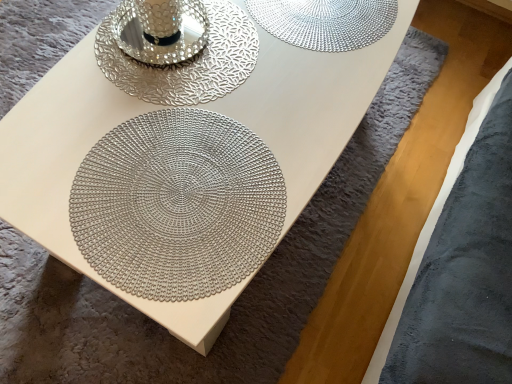
What do you see at coordinates (186, 62) in the screenshot? I see `silver textured candle holder at upper center` at bounding box center [186, 62].

I want to click on silver textured candle holder at upper center, so click(x=186, y=62).

What do you see at coordinates (177, 205) in the screenshot? This screenshot has width=512, height=384. I see `metallic silver mandala at center` at bounding box center [177, 205].

Where is `metallic silver mandala at center`? metallic silver mandala at center is located at coordinates (177, 205).

Locate an element on the screen. This screenshot has width=512, height=384. silver textured candle holder at upper center is located at coordinates (186, 62).

Can you confirm if silver textured candle holder at upper center is positioned to the left of metallic silver mandala at center?

Correct, you'll find silver textured candle holder at upper center to the left of metallic silver mandala at center.

Between silver textured candle holder at upper center and metallic silver mandala at center, which one is positioned behind?

silver textured candle holder at upper center is further from the camera.

Between point (249, 43) and point (137, 251), which one is positioned behind?

The point (249, 43) is farther.

From the image's perspective, is silver textured candle holder at upper center located beneath metallic silver mandala at center?

Actually, silver textured candle holder at upper center appears above metallic silver mandala at center in the image.

From a real-world perspective, is silver textured candle holder at upper center above or below metallic silver mandala at center?

silver textured candle holder at upper center is above metallic silver mandala at center.

Does silver textured candle holder at upper center have a greater width compared to metallic silver mandala at center?

No, silver textured candle holder at upper center is not wider than metallic silver mandala at center.

Considering the sizes of silver textured candle holder at upper center and metallic silver mandala at center in the image, is silver textured candle holder at upper center taller or shorter than metallic silver mandala at center?

Considering their sizes, silver textured candle holder at upper center has more height than metallic silver mandala at center.

In terms of size, does silver textured candle holder at upper center appear bigger or smaller than metallic silver mandala at center?

Considering their sizes, silver textured candle holder at upper center takes up more space than metallic silver mandala at center.

Do you think silver textured candle holder at upper center is within metallic silver mandala at center, or outside of it?

The correct answer is: outside.

Is silver textured candle holder at upper center not near metallic silver mandala at center?

That's not correct — silver textured candle holder at upper center is a little close to metallic silver mandala at center.

Is silver textured candle holder at upper center oriented away from metallic silver mandala at center?

silver textured candle holder at upper center does not have its back to metallic silver mandala at center.

Locate an element on the screen. The height and width of the screenshot is (384, 512). mandala beneath the silver textured candle holder at upper center (from a real-world perspective) is located at coordinates (177, 205).

Between metallic silver mandala at center and silver textured candle holder at upper center, which one appears on the right side from the viewer's perspective?

Positioned to the right is metallic silver mandala at center.

Is the depth of metallic silver mandala at center greater than that of silver textured candle holder at upper center?

No, it is not.

Considering the points (89, 232) and (136, 66), which point is in front, point (89, 232) or point (136, 66)?

Positioned in front is point (89, 232).

From the image's perspective, which is above, metallic silver mandala at center or silver textured candle holder at upper center?

silver textured candle holder at upper center is shown above in the image.

From a real-world perspective, does metallic silver mandala at center stand above silver textured candle holder at upper center?

No, from a real-world perspective, metallic silver mandala at center is not over silver textured candle holder at upper center

Which object is wider, metallic silver mandala at center or silver textured candle holder at upper center?

Wider between the two is metallic silver mandala at center.

Can you confirm if metallic silver mandala at center is taller than silver textured candle holder at upper center?

No, metallic silver mandala at center is not taller than silver textured candle holder at upper center.

Considering the sizes of objects metallic silver mandala at center and silver textured candle holder at upper center in the image provided, who is bigger, metallic silver mandala at center or silver textured candle holder at upper center?

silver textured candle holder at upper center is bigger.

Is metallic silver mandala at center positioned beyond the bounds of silver textured candle holder at upper center?

That's correct, metallic silver mandala at center is outside of silver textured candle holder at upper center.

Is the surface of metallic silver mandala at center in direct contact with silver textured candle holder at upper center?

They are not placed beside each other.

Is metallic silver mandala at center oriented away from silver textured candle holder at upper center?

metallic silver mandala at center does not have its back to silver textured candle holder at upper center.

Could you measure the distance between metallic silver mandala at center and silver textured candle holder at upper center?

23.39 centimeters.

Find the location of a particular element. The image size is (512, 384). candle holder above the metallic silver mandala at center (from a real-world perspective) is located at coordinates (186, 62).

Where is `candle holder located behind the metallic silver mandala at center`? Image resolution: width=512 pixels, height=384 pixels. candle holder located behind the metallic silver mandala at center is located at coordinates (186, 62).

Find the location of a particular element. The image size is (512, 384). candle holder above the metallic silver mandala at center (from a real-world perspective) is located at coordinates (186, 62).